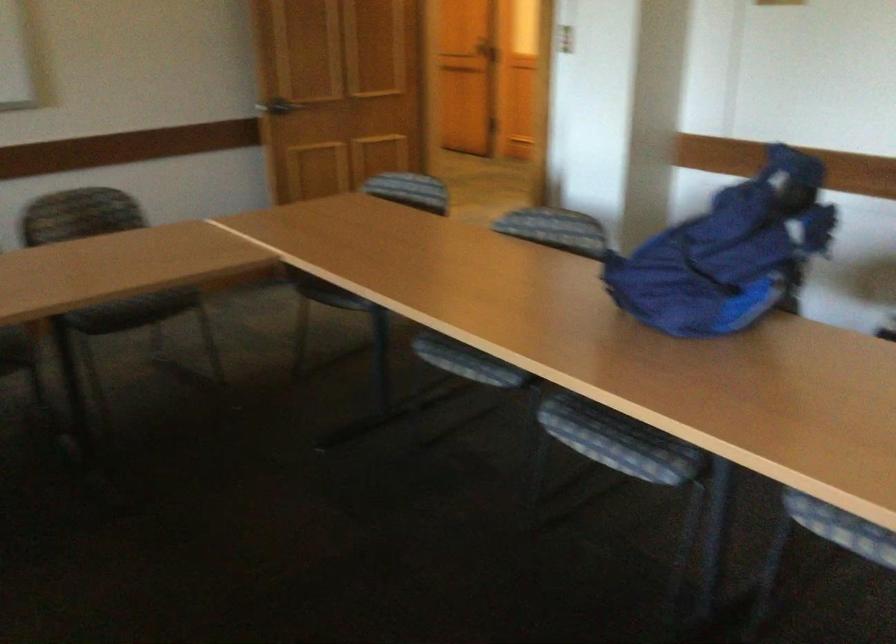
Locate an element on the screen. The height and width of the screenshot is (644, 896). blue backpack is located at coordinates (728, 252).